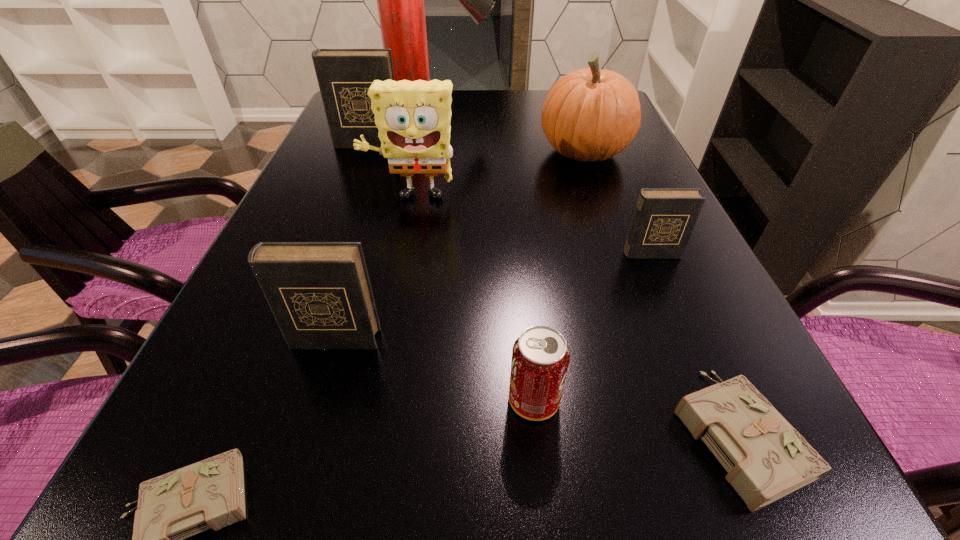
Identify the location of free space between the farthest object and the fifth farthest object. Image resolution: width=960 pixels, height=540 pixels. (544, 176).

Locate an element on the screen. This screenshot has width=960, height=540. object that is the closest to the bigger green diary is located at coordinates (540, 356).

Identify which object is the eighth nearest to the fire extinguisher. Please provide its 2D coordinates. Your answer should be formatted as a tuple, i.e. [(x, y)], where the tuple contains the x and y coordinates of a point satisfying the conditions above.

[(208, 494)]

Where is `diary that stands as the second closest to the sponge`? The image size is (960, 540). diary that stands as the second closest to the sponge is located at coordinates point(320,294).

Locate which diary is the third closest to the farthest dark diary. Please provide its 2D coordinates. Your answer should be formatted as a tuple, i.e. [(x, y)], where the tuple contains the x and y coordinates of a point satisfying the conditions above.

[(208, 494)]

Image resolution: width=960 pixels, height=540 pixels. In order to click on the second closest dark diary to the red soda can in this screenshot , I will do (x=664, y=219).

At what (x,y) coordinates should I click in order to perform the action: click on dark diary that can be found as the closest to the orange pumpkin. Please return your answer as a coordinate pair (x, y). Looking at the image, I should click on (664, 219).

In order to click on free space that satisfies the following two spatial constraints: 1. on the front cover of the bigger green diary; 2. on the left side of the second farthest diary in this screenshot , I will do pyautogui.click(x=728, y=434).

I want to click on free region that satisfies the following two spatial constraints: 1. on the stem of the orange pumpkin; 2. on the back side of the bigger green diary, so [x=681, y=434].

At what (x,y) coordinates should I click in order to perform the action: click on free spot that satisfies the following two spatial constraints: 1. on the stem of the orange pumpkin; 2. on the front cover of the fifth tallest object. Please return your answer as a coordinate pair (x, y). The width and height of the screenshot is (960, 540). Looking at the image, I should click on (648, 340).